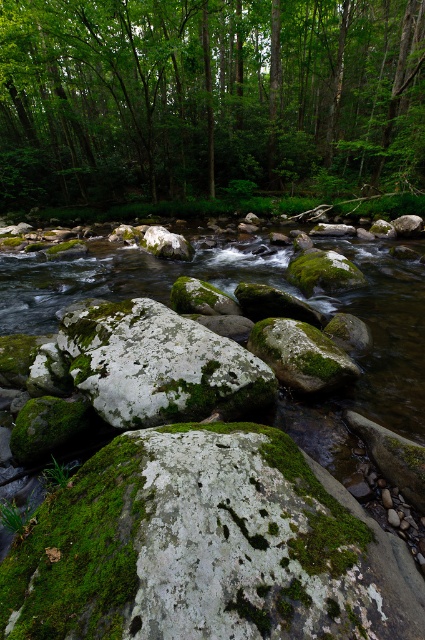
Question: Can you confirm if green leafy tree at upper center is bigger than green mossy rock at center?

Choices:
 (A) yes
 (B) no

Answer: (A)

Question: Which of the following is the closest to the observer?

Choices:
 (A) (282, 138)
 (B) (319, 353)

Answer: (B)

Question: Is green leafy tree at upper center wider than green mossy rock at center?

Choices:
 (A) yes
 (B) no

Answer: (A)

Question: Does green leafy tree at upper center come behind green mossy rock at center?

Choices:
 (A) no
 (B) yes

Answer: (B)

Question: Which of the following is the closest to the observer?

Choices:
 (A) green leafy tree at upper center
 (B) green mossy rock at center

Answer: (B)